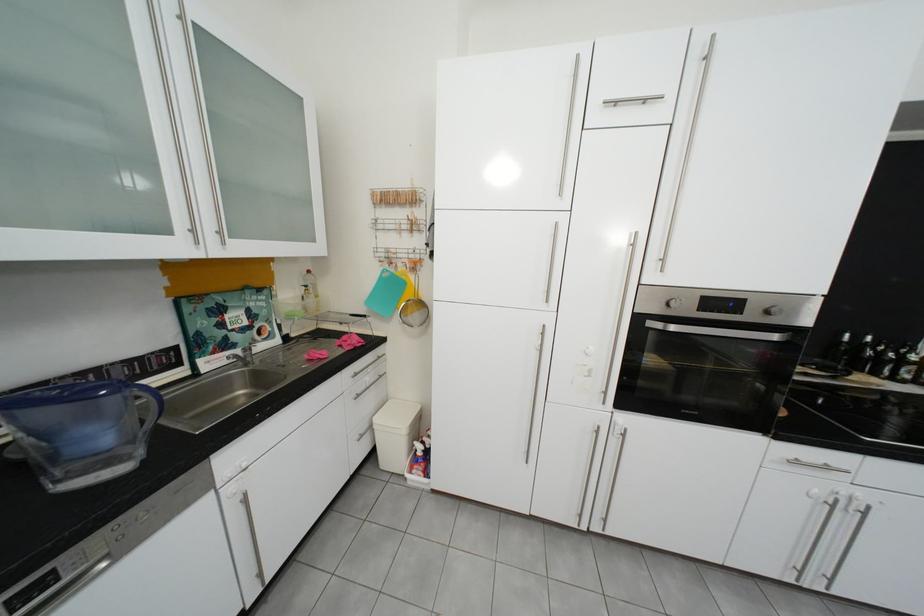
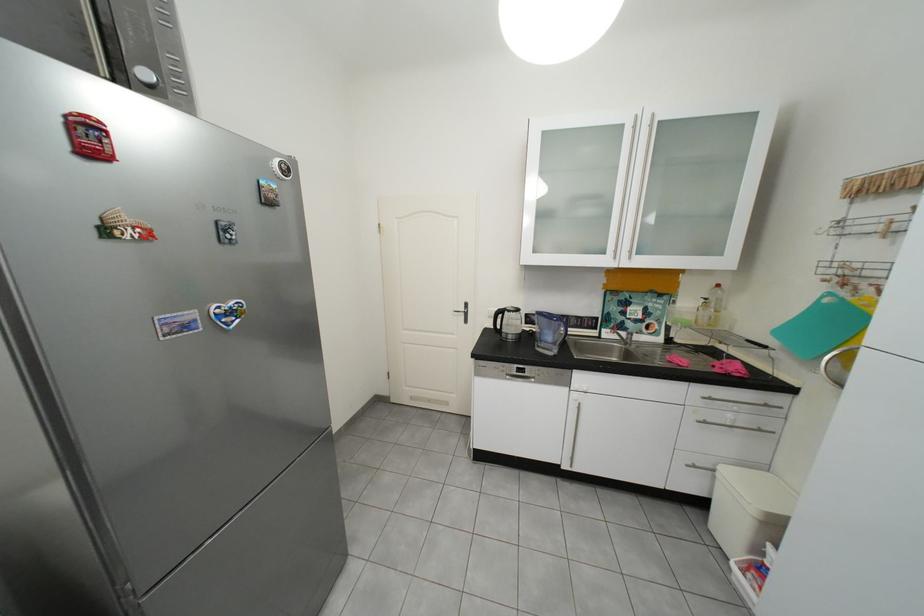
Locate, in the second image, the point that corresponds to [405,228] in the first image.

(881, 230)